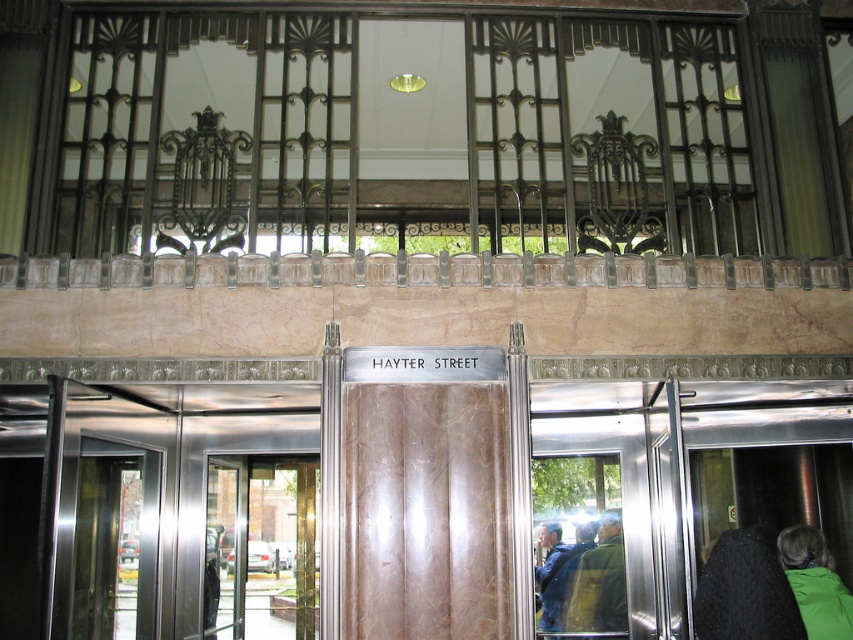
You are a GUI agent. You are given a task and a screenshot of the screen. Output one action in this format:
    pyautogui.click(x=<x>, y=<y>)
    Task: Click on the transparent glass door at center
    Image resolution: width=853 pixels, height=640 pixels.
    Given the screenshot: What is the action you would take?
    pyautogui.click(x=260, y=547)

Does transparent glass door at center have a smaller size compared to blue denim jacket at lower right?

Incorrect, transparent glass door at center is not smaller in size than blue denim jacket at lower right.

Describe the element at coordinates (260, 547) in the screenshot. Image resolution: width=853 pixels, height=640 pixels. I see `transparent glass door at center` at that location.

Locate an element on the screen. This screenshot has width=853, height=640. transparent glass door at center is located at coordinates (260, 547).

Is point (576, 605) farther from camera compared to point (544, 589)?

No, it is in front of (544, 589).

Image resolution: width=853 pixels, height=640 pixels. Identify the location of green fabric jacket at center. (601, 580).

Where is `green fabric jacket at center`? The height and width of the screenshot is (640, 853). green fabric jacket at center is located at coordinates (601, 580).

This screenshot has height=640, width=853. Identify the location of green fabric jacket at center. (601, 580).

Can you confirm if transparent glass door at center is taller than black knitted sweater at lower right?

Yes, transparent glass door at center is taller than black knitted sweater at lower right.

Does transparent glass door at center appear under black knitted sweater at lower right?

Indeed, transparent glass door at center is positioned under black knitted sweater at lower right.

Where is `transparent glass door at center`? transparent glass door at center is located at coordinates (260, 547).

The width and height of the screenshot is (853, 640). In order to click on transparent glass door at center in this screenshot , I will do `click(260, 547)`.